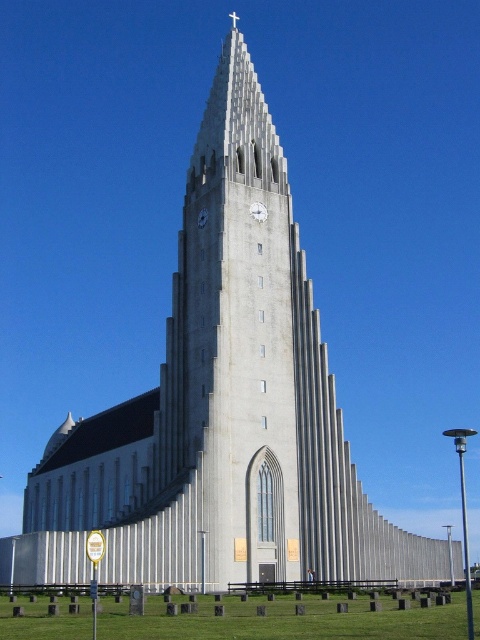
Is white glossy clock at center to the right of white matte clock at center from the viewer's perspective?

Correct, you'll find white glossy clock at center to the right of white matte clock at center.

Image resolution: width=480 pixels, height=640 pixels. Describe the element at coordinates (257, 211) in the screenshot. I see `white glossy clock at center` at that location.

Where is `white glossy clock at center`? white glossy clock at center is located at coordinates (257, 211).